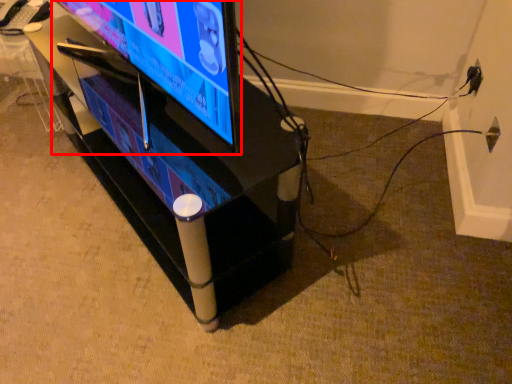
Question: From the image's perspective, where is television (annotated by the red box) located in relation to furniture in the image?

Choices:
 (A) above
 (B) below

Answer: (A)